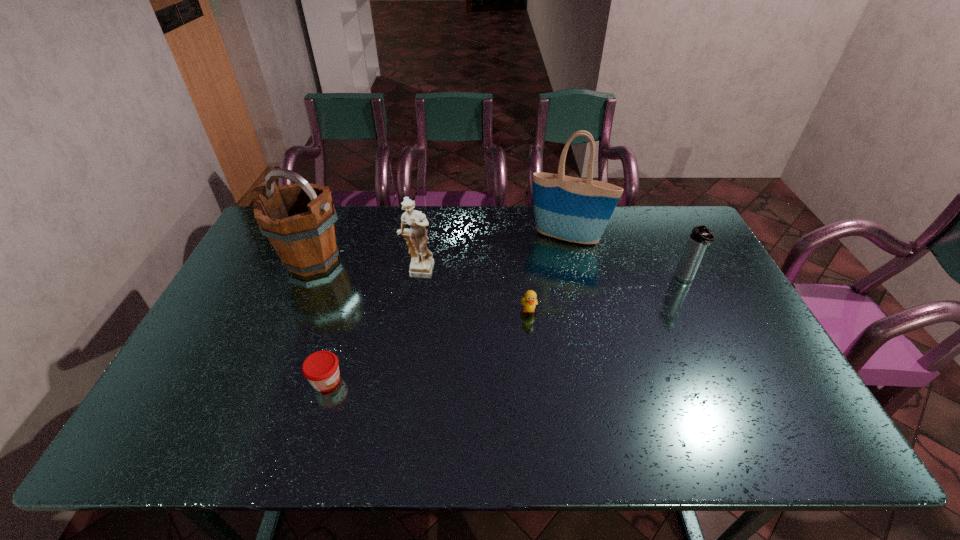
At what (x,y) coordinates should I click in order to perform the action: click on free space located on the front of the tote bag. Please return your answer as a coordinate pair (x, y). The height and width of the screenshot is (540, 960). Looking at the image, I should click on (581, 293).

The height and width of the screenshot is (540, 960). Find the location of `vacant space situated on the right of the leftmost object`. vacant space situated on the right of the leftmost object is located at coordinates (411, 260).

The height and width of the screenshot is (540, 960). Find the location of `vacant space located 0.260m on the front-facing side of the figurine`. vacant space located 0.260m on the front-facing side of the figurine is located at coordinates coord(405,355).

The height and width of the screenshot is (540, 960). Identify the location of vacant space located on the handle side of the third shortest object. (730, 372).

Identify the location of vacant space located on the front-facing side of the duckling. The image size is (960, 540). (536, 374).

Where is `vacant region located 0.220m on the label side of the fifth object from right to left`? vacant region located 0.220m on the label side of the fifth object from right to left is located at coordinates (433, 380).

Locate an element on the screen. This screenshot has width=960, height=540. tote bag that is at the far edge is located at coordinates (577, 210).

Where is `bucket at the far edge`? bucket at the far edge is located at coordinates (299, 219).

Where is `object that is at the left edge`? The image size is (960, 540). object that is at the left edge is located at coordinates (299, 219).

Where is `object positioned at the right edge`? object positioned at the right edge is located at coordinates pos(701,236).